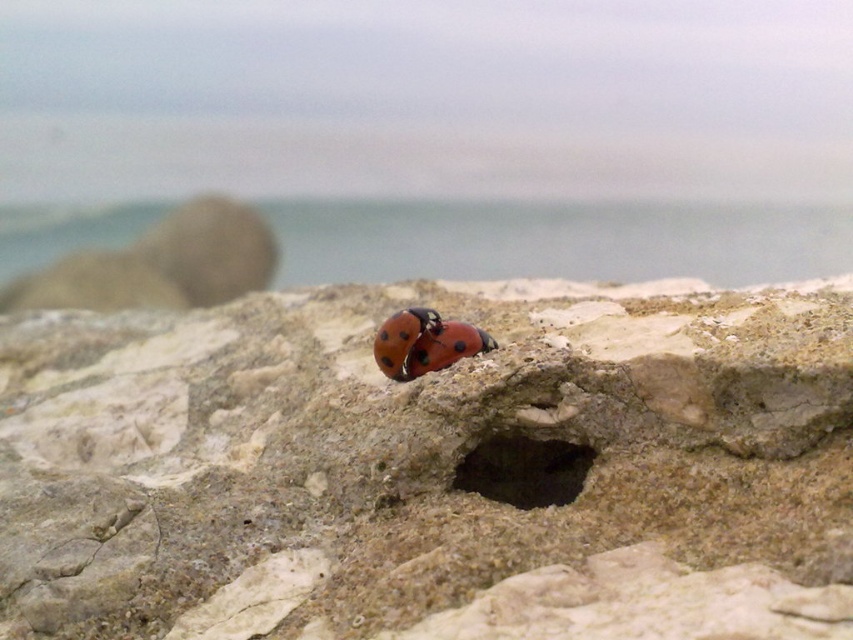
Question: Observing the image, what is the correct spatial positioning of smooth stone ladybug at center in reference to shiny red beetle at center?

Choices:
 (A) above
 (B) below

Answer: (B)

Question: Which point is farther from the camera taking this photo?

Choices:
 (A) (381, 356)
 (B) (573, 477)

Answer: (A)

Question: Can you confirm if dark stone hole at center is wider than shiny red beetle at center?

Choices:
 (A) yes
 (B) no

Answer: (B)

Question: Considering the relative positions of smooth stone ladybug at center and dark stone hole at center in the image provided, where is smooth stone ladybug at center located with respect to dark stone hole at center?

Choices:
 (A) above
 (B) below

Answer: (A)

Question: Which point appears closest to the camera in this image?

Choices:
 (A) (564, 490)
 (B) (480, 337)
 (C) (109, 532)

Answer: (C)

Question: Which of the following is the closest to the observer?

Choices:
 (A) smooth stone ladybug at center
 (B) dark stone hole at center

Answer: (A)